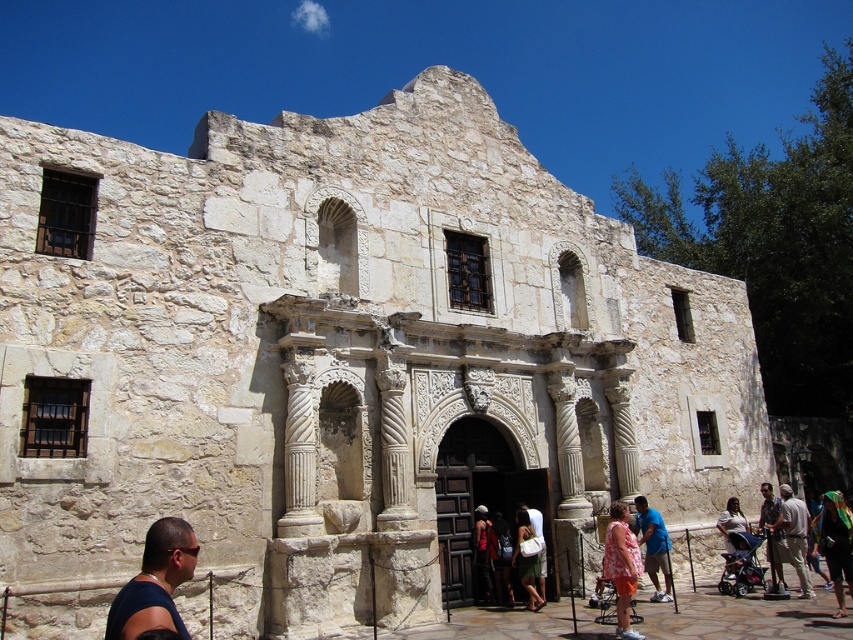
Question: Observing the image, what is the correct spatial positioning of orange floral dress at lower right in reference to dark blue denim jeans at center?

Choices:
 (A) left
 (B) right

Answer: (B)

Question: Is dark blue denim jeans at center bigger than green textured dress at center?

Choices:
 (A) no
 (B) yes

Answer: (B)

Question: Is blue cotton shirt at center thinner than red shirt at center?

Choices:
 (A) yes
 (B) no

Answer: (A)

Question: Which point is farther to the camera?

Choices:
 (A) camouflage fabric shirt at lower right
 (B) dark blue t-shirt at lower left
 (C) green textured dress at center
 (D) blue cotton shirt at center

Answer: (D)

Question: Among these objects, which one is farthest from the camera?

Choices:
 (A) red shirt at center
 (B) camouflage fabric shirt at lower right

Answer: (A)

Question: Estimate the real-world distances between objects in this image. Which object is farther from the green fabric headscarf at lower right?

Choices:
 (A) light beige cotton shirt at lower right
 (B) dark blue denim jeans at center
 (C) dark blue t-shirt at lower left
 (D) blue cotton shirt at center

Answer: (C)